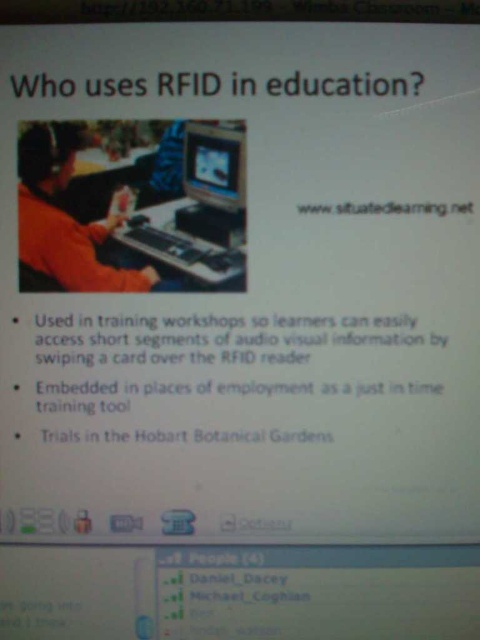
Is orange fabric shirt at left in front of matte black monitor at center?

Yes.

Between orange fabric shirt at left and matte black monitor at center, which one has more height?

orange fabric shirt at left is taller.

Where is `orange fabric shirt at left`? This screenshot has height=640, width=480. orange fabric shirt at left is located at coordinates (68, 214).